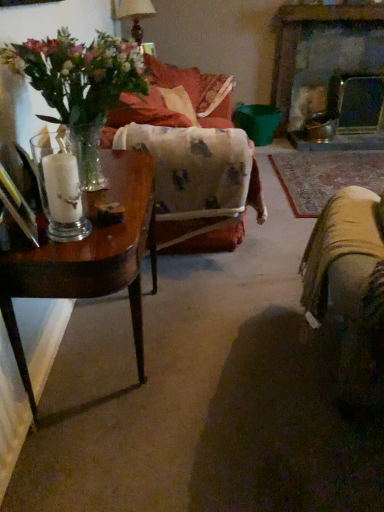
Question: From their relative heights in the image, would you say clear glass candle at left is taller or shorter than velvet orange couch at center, which is the 1th couch in back-to-front order?

Choices:
 (A) short
 (B) tall

Answer: (A)

Question: Is point (62, 192) closer or farther from the camera than point (223, 87)?

Choices:
 (A) farther
 (B) closer

Answer: (B)

Question: Based on their relative distances, which object is farther from the clear glass candle at left?

Choices:
 (A) matte white lampshade at upper center
 (B) velvet floral couch at center, marked as the second couch in a back-to-front arrangement
 (C) translucent glass vase at left
 (D) velvet orange couch at center, the 2th couch viewed from the front
 (E) wooden table at left

Answer: (A)

Question: Estimate the real-world distances between objects in this image. Which object is closer to the wooden table at left?

Choices:
 (A) matte white lampshade at upper center
 (B) velvet orange couch at center, which is the 1th couch in back-to-front order
 (C) velvet floral couch at center, the 1th couch viewed from the front
 (D) smooth stone fireplace at upper right
 (E) translucent glass vase at left

Answer: (E)